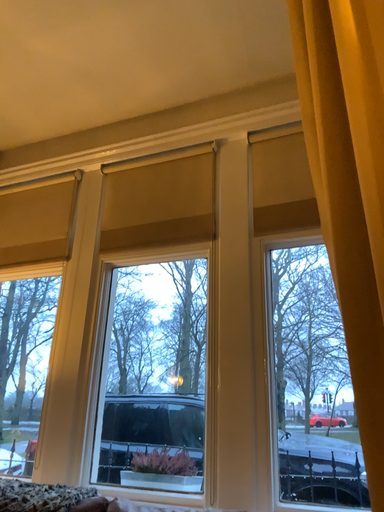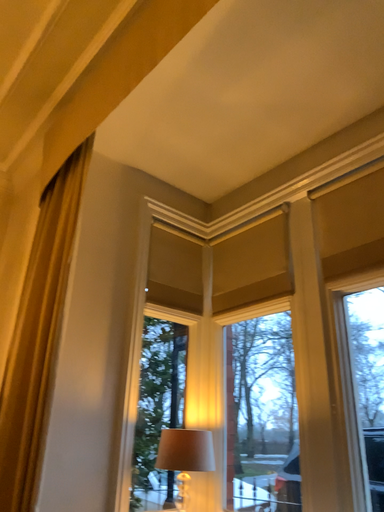
Question: How did the camera likely rotate when shooting the video?

Choices:
 (A) rotated left
 (B) rotated right

Answer: (A)